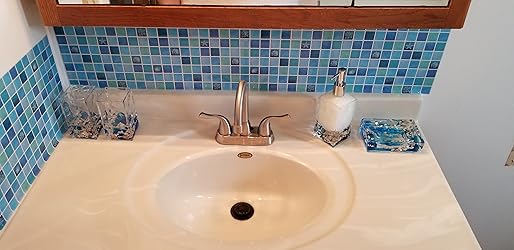
Where is `faucet`? This screenshot has height=250, width=514. faucet is located at coordinates (249, 137).